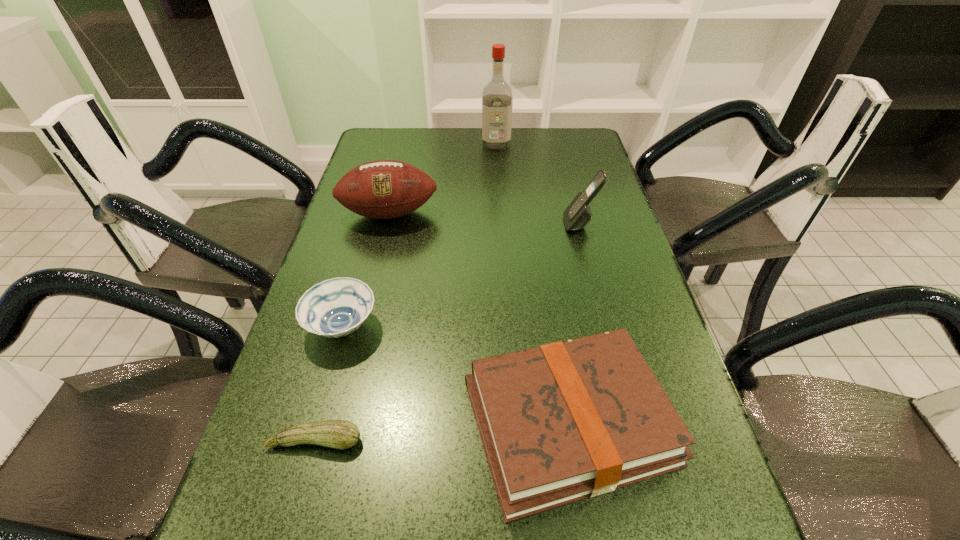
Locate an element on the screen. vacant region located on the front-facing side of the cellular telephone is located at coordinates (420, 224).

Image resolution: width=960 pixels, height=540 pixels. In order to click on free spot located on the right of the football (American) in this screenshot , I will do `click(570, 213)`.

This screenshot has height=540, width=960. I want to click on blank space located 0.150m on the left of the third shortest object, so click(x=383, y=423).

Where is `free space located on the front of the fifth tallest object`? The image size is (960, 540). free space located on the front of the fifth tallest object is located at coordinates (294, 499).

The width and height of the screenshot is (960, 540). Identify the location of vacant space located at the stem end of the shortest object. (299, 503).

Locate an element on the screen. This screenshot has width=960, height=540. object present at the far edge is located at coordinates (497, 101).

At what (x,y) coordinates should I click in order to perform the action: click on football (American) that is at the left edge. Please return your answer as a coordinate pair (x, y). The height and width of the screenshot is (540, 960). Looking at the image, I should click on (383, 189).

I want to click on soup bowl that is positioned at the left edge, so click(x=336, y=307).

Where is `zucchini present at the left edge`? The height and width of the screenshot is (540, 960). zucchini present at the left edge is located at coordinates (341, 434).

The image size is (960, 540). In order to click on cellular telephone at the right edge in this screenshot , I will do `click(578, 214)`.